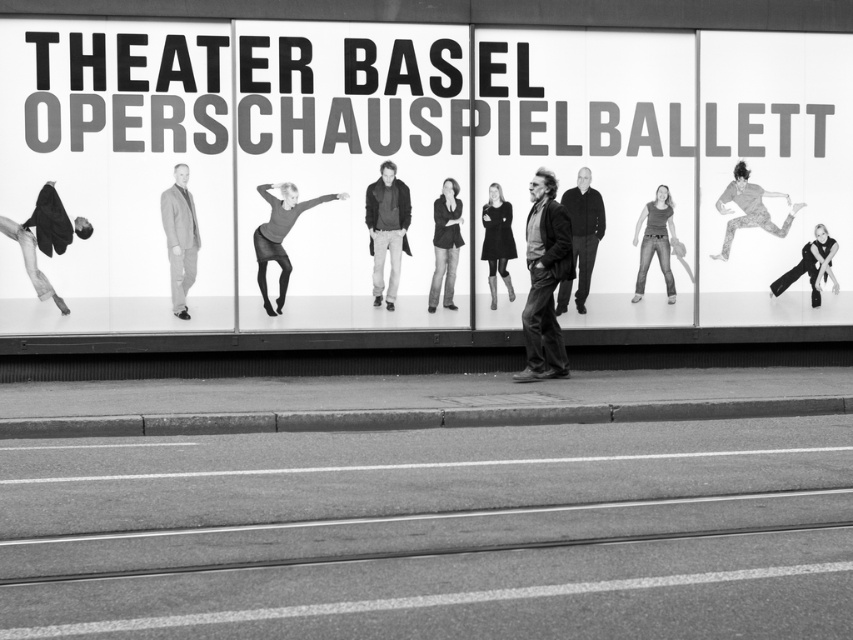
Question: Among these objects, which one is nearest to the camera?

Choices:
 (A) dark gray fabric jacket at center
 (B) concrete at lower center

Answer: (B)

Question: Can you confirm if black glossy poster at center is thinner than patterned fabric dancer at right?

Choices:
 (A) yes
 (B) no

Answer: (B)

Question: Which of the following is the closest to the observer?

Choices:
 (A) (595, 241)
 (B) (543, 253)
 (C) (500, 204)

Answer: (B)

Question: From the image, what is the correct spatial relationship of dark gray sweater at center in relation to black matte dress at center?

Choices:
 (A) above
 (B) below

Answer: (A)

Question: Can you confirm if black matte skateboard at left is positioned below patterned fabric dancer at right?

Choices:
 (A) no
 (B) yes

Answer: (B)

Question: Considering the real-world distances, which object is closest to the black matte skateboard at left?

Choices:
 (A) concrete at lower center
 (B) black matte dress at center
 (C) leather jacket at center
 (D) black glossy poster at center

Answer: (D)